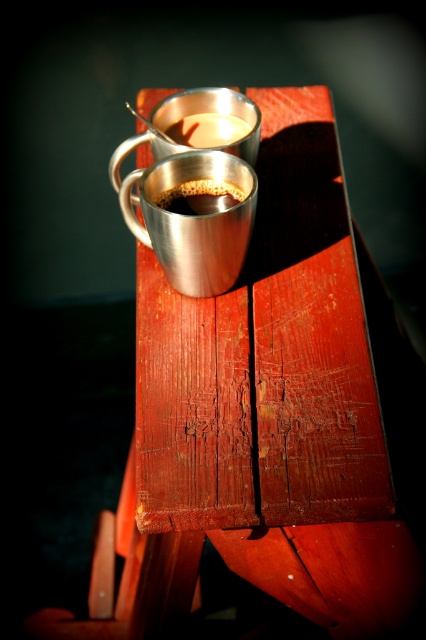
Is point (324, 236) farther from camera compared to point (230, 205)?

Yes, it is behind point (230, 205).

What do you see at coordinates (271, 408) in the screenshot? The image size is (426, 640). I see `metallic polished table at center` at bounding box center [271, 408].

Describe the element at coordinates (271, 408) in the screenshot. I see `metallic polished table at center` at that location.

Identify the location of metallic polished table at center. Image resolution: width=426 pixels, height=640 pixels. (271, 408).

Does shiny metallic mug at center have a lesser height compared to shiny metallic cup at center?

Incorrect, shiny metallic mug at center's height does not fall short of shiny metallic cup at center's.

Is shiny metallic mug at center positioned in front of shiny metallic cup at center?

Yes.

Measure the distance between point (230, 157) and camera.

The distance of point (230, 157) from camera is 96.11 centimeters.

Identify the location of shiny metallic mug at center. (193, 221).

Locate an element on the screen. This screenshot has width=426, height=640. metallic polished table at center is located at coordinates (271, 408).

Who is taller, metallic polished table at center or shiny metallic mug at center?

With more height is metallic polished table at center.

Is point (337, 596) positioned behind point (199, 220)?

That is True.

The image size is (426, 640). Identify the location of metallic polished table at center. (271, 408).